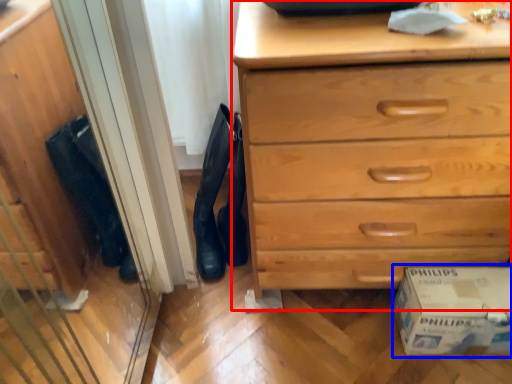
Question: Which object is further to the camera taking this photo, chest of drawers (highlighted by a red box) or cardboard box (highlighted by a blue box)?

Choices:
 (A) chest of drawers
 (B) cardboard box

Answer: (B)